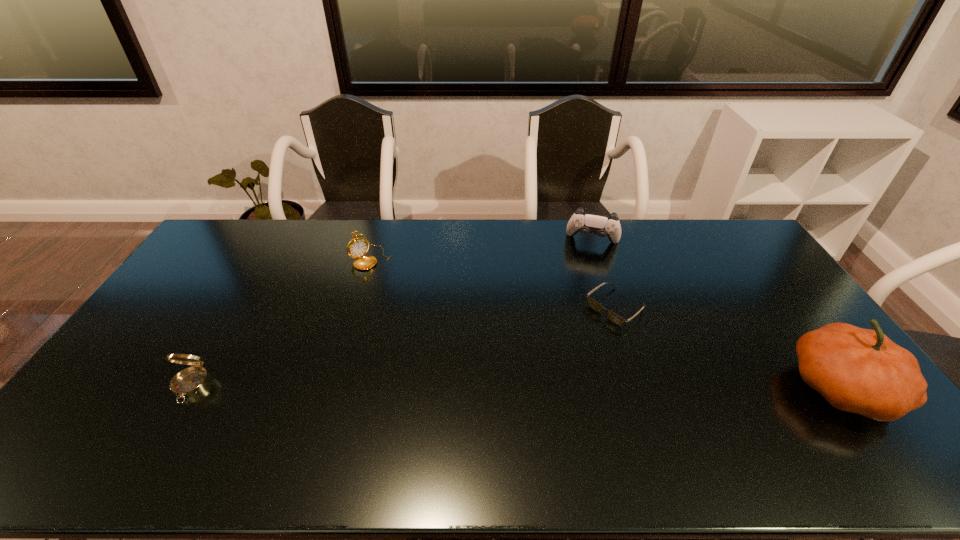
In order to click on compass in this screenshot , I will do `click(190, 381)`.

This screenshot has height=540, width=960. In order to click on the rightmost object in this screenshot , I will do `click(857, 370)`.

You are a GUI agent. You are given a task and a screenshot of the screen. Output one action in this format:
    pyautogui.click(x=<x>, y=<y>)
    Task: Click on the pumpkin
    The width and height of the screenshot is (960, 540).
    Given the screenshot: What is the action you would take?
    pyautogui.click(x=857, y=370)

Where is `the second object from left to right`? This screenshot has width=960, height=540. the second object from left to right is located at coordinates (357, 247).

Find the location of a particular element. The height and width of the screenshot is (540, 960). sunglasses is located at coordinates (615, 318).

At what (x,y) coordinates should I click in order to perform the action: click on the shortest object. Please return your answer as a coordinate pair (x, y). The height and width of the screenshot is (540, 960). Looking at the image, I should click on (615, 318).

Identify the location of control. (602, 225).

Find the location of a particular element. The width and height of the screenshot is (960, 540). vacant area located with the dial facing the leftmost object is located at coordinates (168, 425).

Find the location of `vacant area located on the face of the second object from left to right`. vacant area located on the face of the second object from left to right is located at coordinates click(428, 319).

Identify the location of free space located on the face of the second object from left to right. (420, 309).